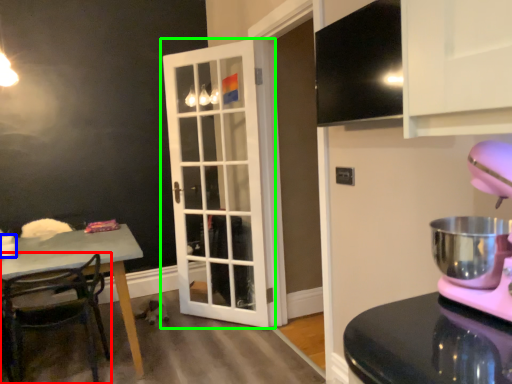
Question: Which is nearer to the chair (highlighted by a red box)? coffee cup (highlighted by a blue box) or door (highlighted by a green box).

Choices:
 (A) coffee cup
 (B) door

Answer: (A)